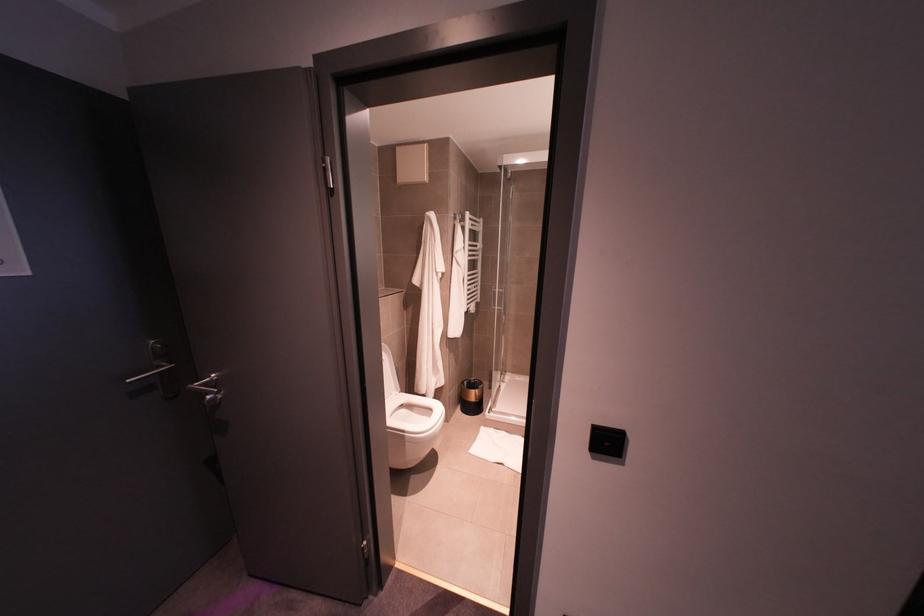
Find where to pull the shower door handle. Please return your answer as a coordinate pair (x, y).

(495, 299)